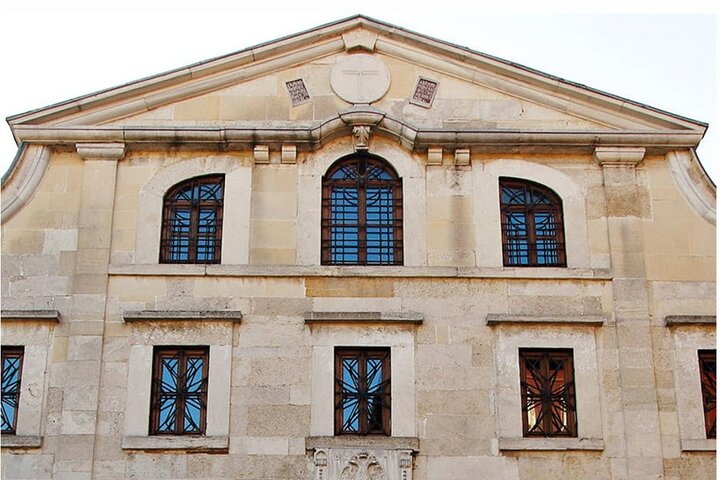
Locate an element on the screen. window is located at coordinates (355, 221), (196, 228), (534, 231), (186, 383), (6, 374), (559, 401), (373, 395), (710, 379).